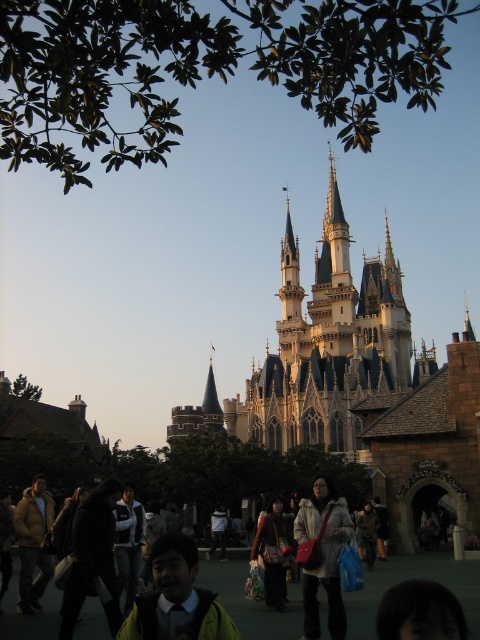
From the picture: Does white stone castle at center appear over matte black jacket at center?

Yes.

How much distance is there between white stone castle at center and matte black jacket at center?

white stone castle at center is 33.68 meters from matte black jacket at center.

Is point (191, 417) less distant than point (288, 534)?

No, it is behind (288, 534).

Where is `white stone castle at center`? white stone castle at center is located at coordinates (365, 380).

Between white stone castle at center and green matte jacket at lower center, which one is positioned higher?

white stone castle at center is higher up.

Is point (377, 467) farther from camera compared to point (155, 568)?

Yes, point (377, 467) is farther from viewer.

Identify the location of white stone castle at center. (365, 380).

Can you confirm if white stone castle at center is bigger than matte gray coat at center?

Yes, white stone castle at center is bigger than matte gray coat at center.

Is point (468, 502) positioned after point (316, 528)?

Yes, point (468, 502) is farther from viewer.

Where is `white stone castle at center`? white stone castle at center is located at coordinates (365, 380).